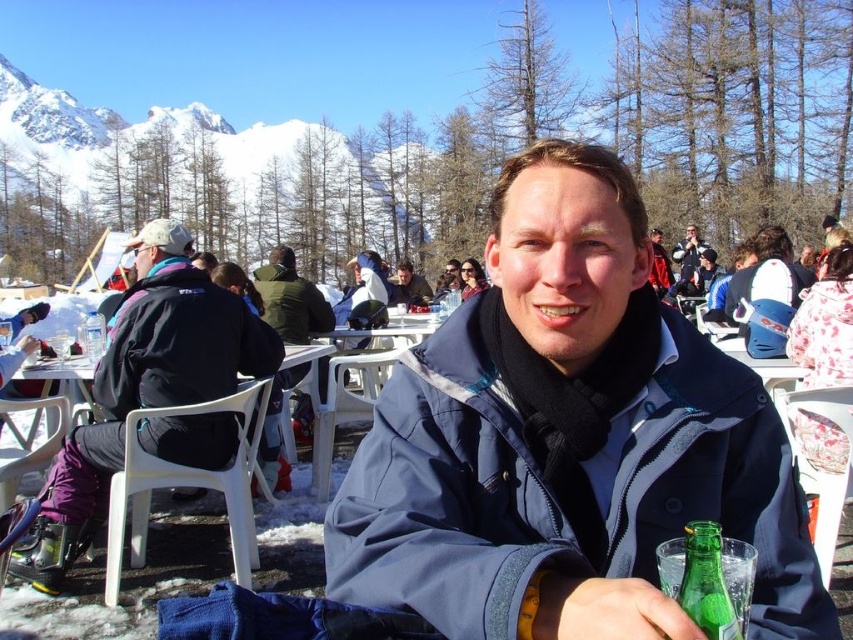
Question: Observing the image, what is the correct spatial positioning of dark green jacket at center in reference to green matte jacket at center?

Choices:
 (A) right
 (B) left

Answer: (A)

Question: Among these points, which one is farthest from the camera?

Choices:
 (A) (84, 332)
 (B) (15, 161)
 (C) (294, 324)

Answer: (B)

Question: Does snowy mountain at upper left appear over dark green jacket at center?

Choices:
 (A) yes
 (B) no

Answer: (A)

Question: Observing the image, what is the correct spatial positioning of matte black jacket at center in reference to blue fleece jacket at center?

Choices:
 (A) left
 (B) right

Answer: (A)

Question: Which of the following is the closest to the observer?

Choices:
 (A) (96, 336)
 (B) (293, 365)
 (C) (711, 573)
 (D) (691, 262)

Answer: (C)

Question: Which object is the farthest from the green glass bottle at lower right?

Choices:
 (A) snowy mountain at upper left
 (B) blue matte jacket at center
 (C) clear plastic bottle at center

Answer: (A)